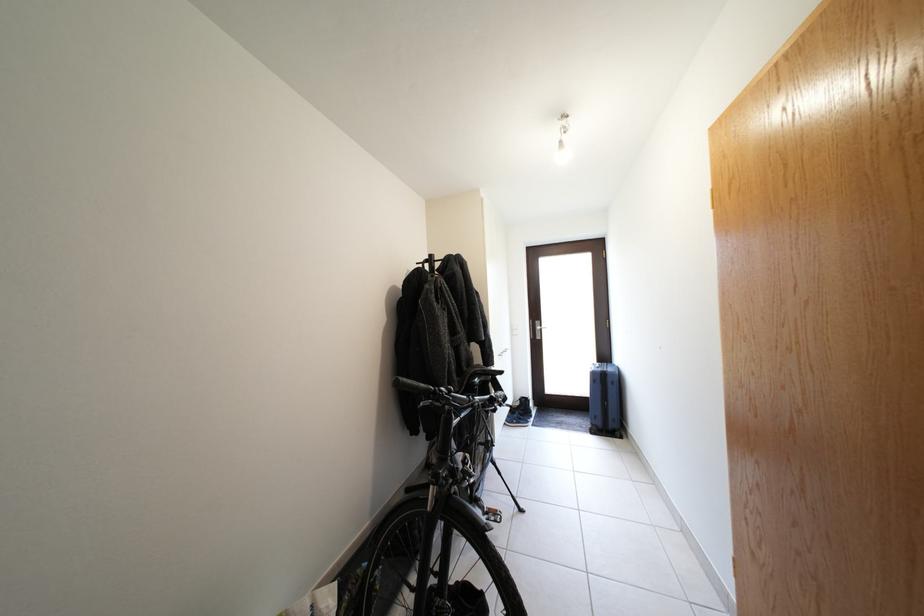
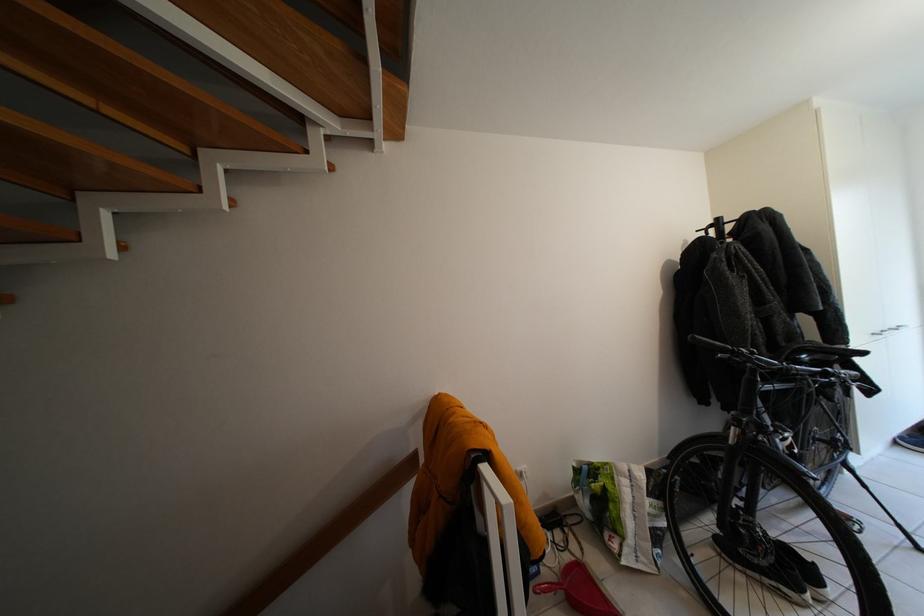
In the second image, find the point that corresponds to point (412, 390) in the first image.

(710, 345)